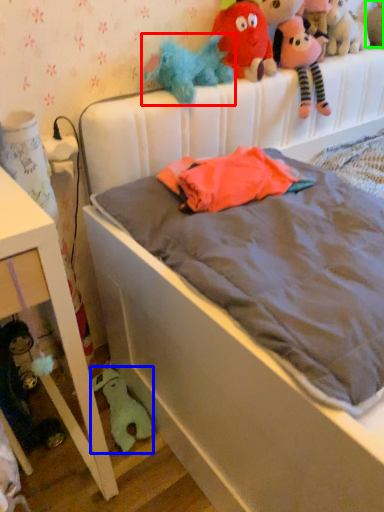
Question: Which is nearer to the toy (highlighted by a red box)? toy (highlighted by a blue box) or toy (highlighted by a green box).

Choices:
 (A) toy
 (B) toy

Answer: (B)